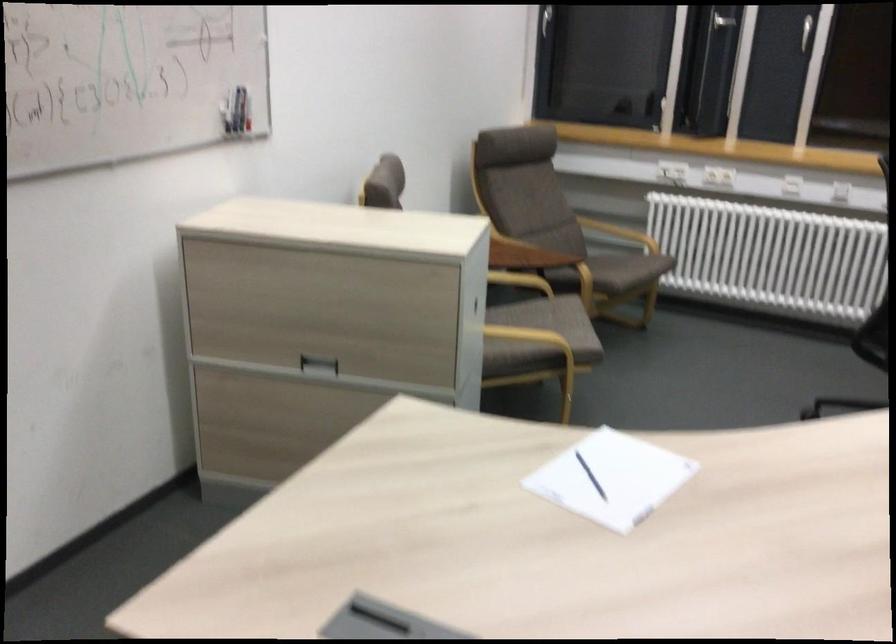
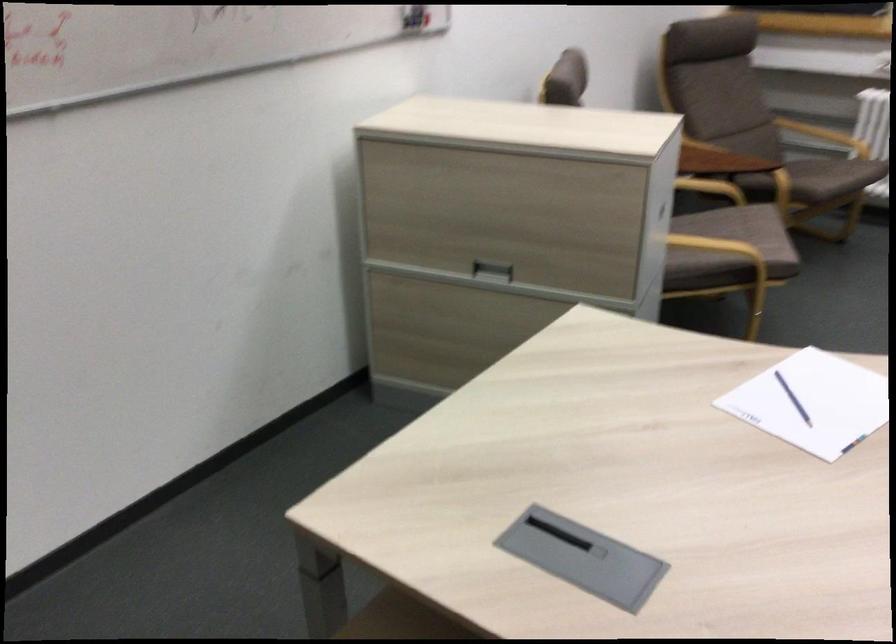
Question: The camera is either moving clockwise (left) or counter-clockwise (right) around the object. The first image is from the beginning of the video and the second image is from the end. Is the camera moving left or right when shooting the video?

Choices:
 (A) Left
 (B) Right

Answer: (B)